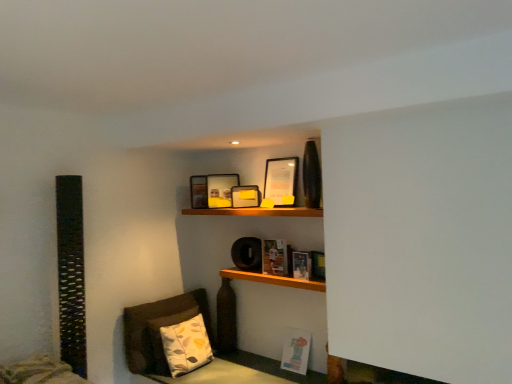
Question: Is matte yellow picture frame at upper center, the third picture frame in the front-to-back sequence, taller or shorter than matte black picture frame at upper center, which is counted as the 4th picture frame, starting from the front?

Choices:
 (A) short
 (B) tall

Answer: (A)

Question: From the image's perspective, is matte yellow picture frame at upper center, the third picture frame in the front-to-back sequence, positioned above or below matte black picture frame at upper center, which is counted as the 4th picture frame, starting from the front?

Choices:
 (A) above
 (B) below

Answer: (A)

Question: Considering the real-world distances, which object is closest to the wooden shelf at upper center, which is the second shelf from bottom to top?

Choices:
 (A) matte paper book at center, the 1th book viewed from the top
 (B) matte yellow picture frame at upper center, the third picture frame in the front-to-back sequence
 (C) matte black picture frame at upper center, which is the fourth picture frame from back to front
 (D) hardcover book at center, the second book when ordered from top to bottom
 (E) wooden shelf at center, the 1th shelf ordered from the bottom

Answer: (B)

Question: Which of these objects is positioned closest to the matte paper book at center, which ranks as the 3th book in bottom-to-top order?

Choices:
 (A) matte black picture frame at upper center, which is counted as the first picture frame, starting from the front
 (B) wooden shelf at center, which is counted as the second shelf, starting from the top
 (C) wooden shelf at upper center, which is the second shelf from bottom to top
 (D) matte paper book at lower right, the 1th book when ordered from bottom to top
 (E) matte black picture frame at upper center, which is counted as the 4th picture frame, starting from the front

Answer: (B)